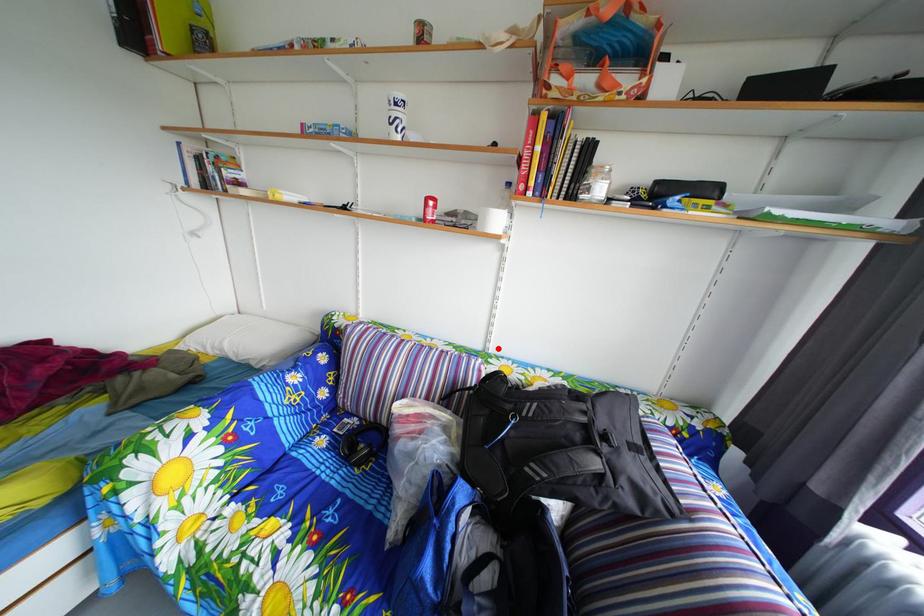
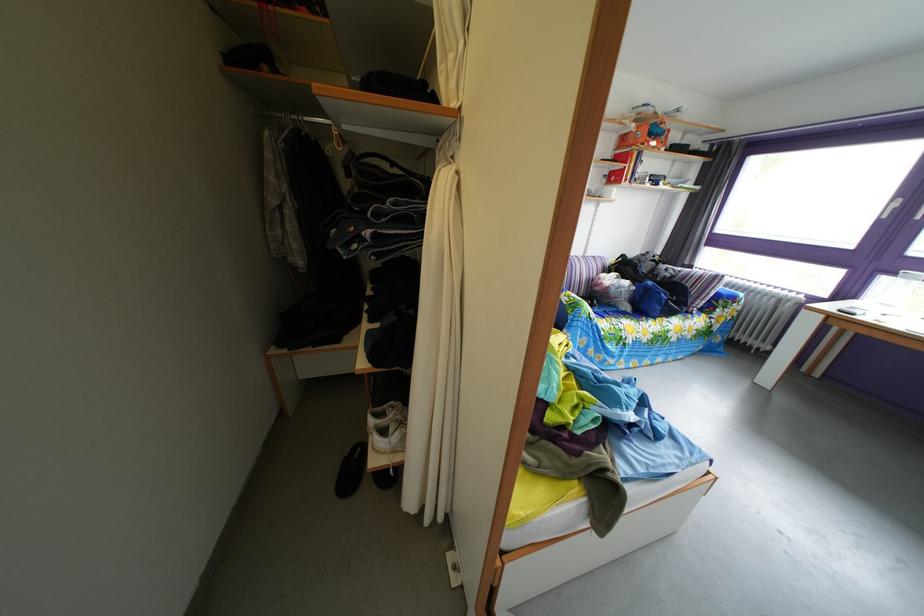
In the second image, find the point that corresponds to the highlighted location in the first image.

(596, 261)